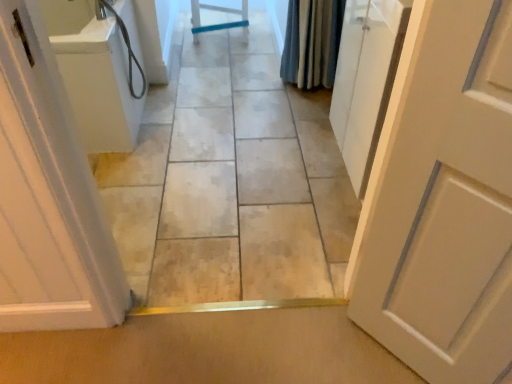
What are the coordinates of `free point to the right of white glossy door at left, which ranks as the first door in left-to-right order` in the screenshot? It's located at (137, 250).